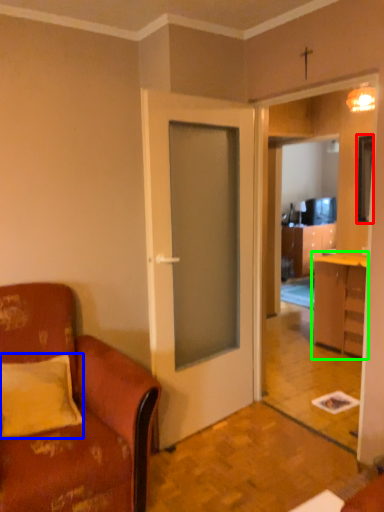
Question: Which is nearer to the television (highlighted by a red box)? pillow (highlighted by a blue box) or cabinetry (highlighted by a green box).

Choices:
 (A) pillow
 (B) cabinetry

Answer: (B)